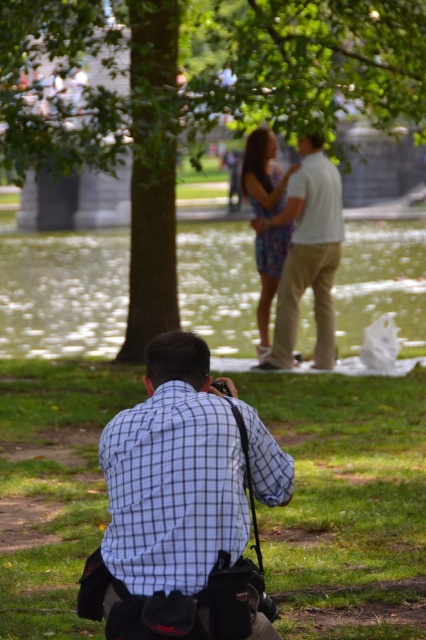
Based on the scene described, which object between the green grass at lower center and the green leafy tree at upper center occupies a larger area in the image?

The green leafy tree at upper center occupies a larger area in the image compared to the green grass at lower center, as stated in the objects description that the green grass at lower center has a smaller size compared to the green leafy tree at upper center.

You are a photographer standing at the edge of the green grass at lower center and want to take a photo of the green leafy tree at upper center. Considering your camera has a maximum focus range of 7 meters, will you be able to capture the tree clearly without moving closer?

The distance between the green grass at lower center and the green leafy tree at upper center is 7.05 meters. Since the camera can only focus up to 7 meters, you will not be able to capture the tree clearly without moving closer.